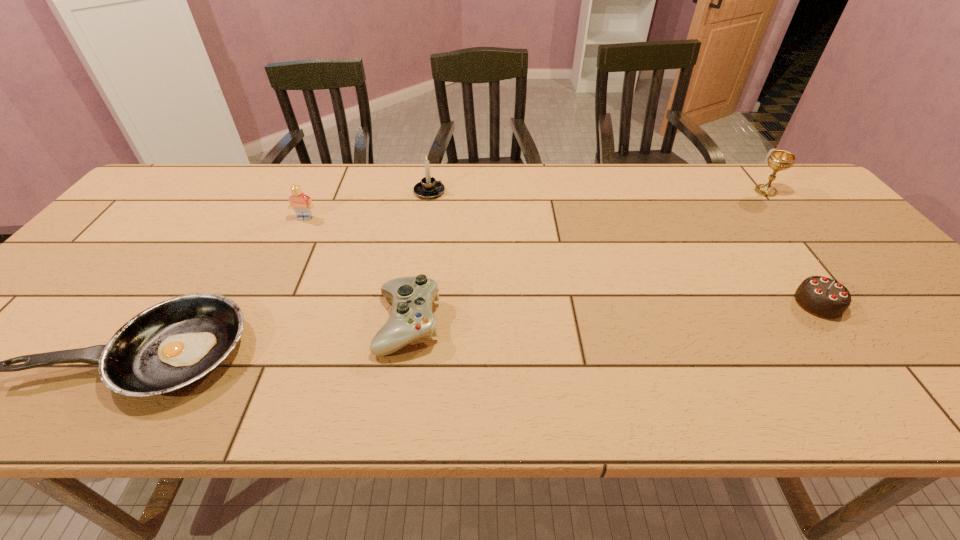
You are a GUI agent. You are given a task and a screenshot of the screen. Output one action in this format:
    pyautogui.click(x=<x>, y=<y>)
    Task: Click on the free location that satisfies the following two spatial constraints: 1. on the front-facing side of the second object from right to left; 2. on the left side of the Lego
    This screenshot has height=540, width=960.
    Given the screenshot: What is the action you would take?
    pyautogui.click(x=264, y=303)

Locate an element on the screen. This screenshot has height=540, width=960. free spot that satisfies the following two spatial constraints: 1. on the front-facing side of the fourth nearest object; 2. on the left side of the control is located at coordinates (255, 323).

In order to click on free space that satisfies the following two spatial constraints: 1. on the front-facing side of the fourth nearest object; 2. on the left side of the control in this screenshot , I will do `click(255, 323)`.